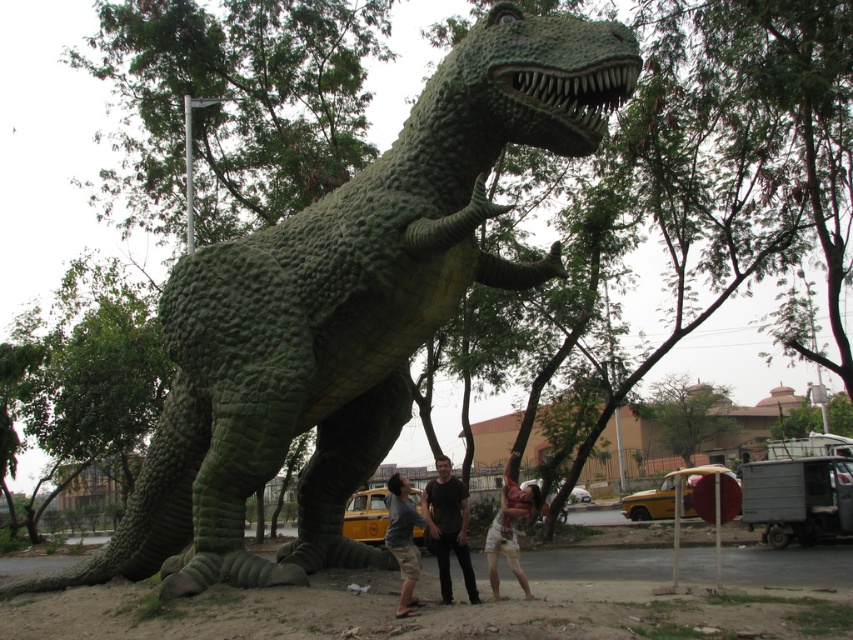
In the scene shown: Which is more to the right, dark brown shirt at center or light brown shorts at lower center?

From the viewer's perspective, light brown shorts at lower center appears more on the right side.

This screenshot has height=640, width=853. What do you see at coordinates (448, 528) in the screenshot? I see `dark brown shirt at center` at bounding box center [448, 528].

Find the location of a particular element. The height and width of the screenshot is (640, 853). dark brown shirt at center is located at coordinates (448, 528).

Can you confirm if dark brown shirt at center is shorter than light brown cotton shorts at center?

Correct, dark brown shirt at center is not as tall as light brown cotton shorts at center.

Based on the photo, measure the distance from dark brown shirt at center to light brown cotton shorts at center.

The distance of dark brown shirt at center from light brown cotton shorts at center is 1.06 meters.

What are the coordinates of `dark brown shirt at center` in the screenshot? It's located at (448, 528).

Locate an element on the screen. dark brown shirt at center is located at coordinates (448, 528).

Can you confirm if light brown shorts at lower center is bigger than light brown cotton shorts at center?

Correct, light brown shorts at lower center is larger in size than light brown cotton shorts at center.

Is light brown shorts at lower center below light brown cotton shorts at center?

Indeed, light brown shorts at lower center is positioned under light brown cotton shorts at center.

Is point (517, 499) positioned after point (398, 532)?

That is True.

At what (x,y) coordinates should I click in order to perform the action: click on light brown shorts at lower center. Please return your answer as a coordinate pair (x, y). Image resolution: width=853 pixels, height=640 pixels. Looking at the image, I should click on (509, 529).